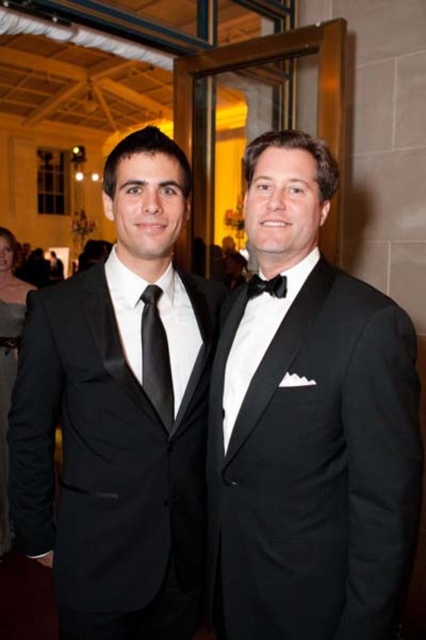
You are standing in the grand hall and want to reach the point marked as point (305, 544). If you take a step forward of 4 feet, will you reach that point?

The point (305, 544) is 3.97 feet from the viewer. If you take a step forward of 4 feet, you will reach that point.

In the image, there are two men in formal wear. One has a black tie and the other has a bow tie. A point labeled point (6, 403) marks the location of the matte black dress at lower left. Based on the coordinates, can you determine which man is wearing the matte black dress at lower left?

The matte black dress at lower left is represented by point (6, 403). Since the point is at lower left, it corresponds to the man on the left side of the image, who is wearing the black tie.

You are a photographer at a formal event and need to ensure both the black satin tuxedo at center and the black satin tie at center are visible in your photo. Given their widths, which one will occupy more space horizontally in the frame?

The black satin tuxedo at center has a greater width than the black satin tie at center, so it will occupy more horizontal space in the frame.